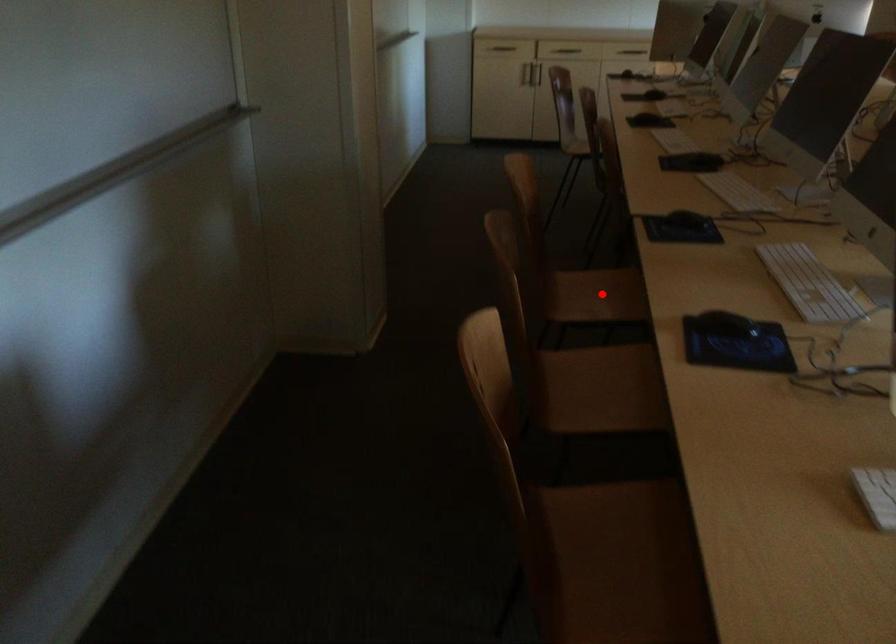
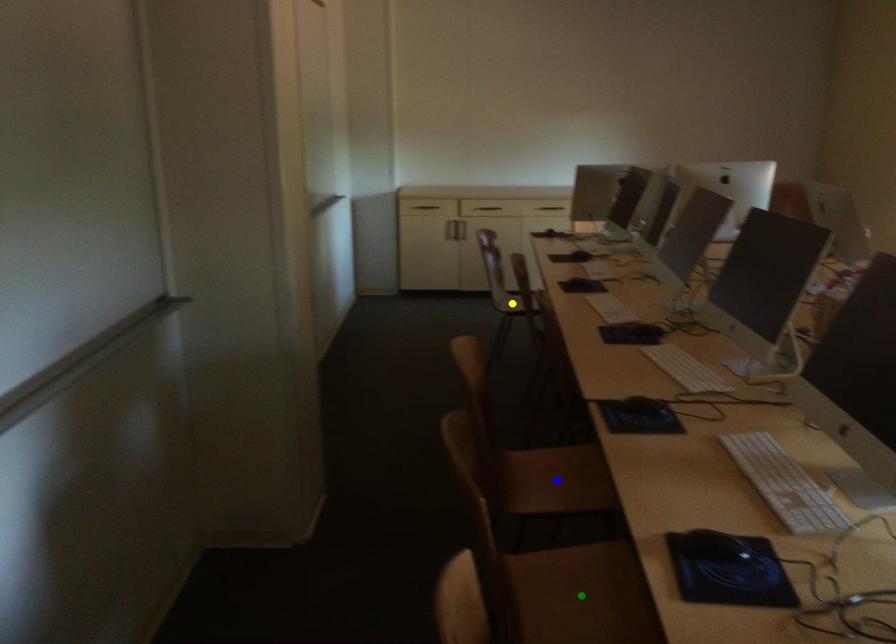
Question: I am providing you with two images of the same scene from different viewpoints. A red point is marked on the first image. You are given multiple points on the second image. Which point in image 2 is actually the same real-world point as the red point in image 1?

Choices:
 (A) green point
 (B) blue point
 (C) yellow point

Answer: (B)